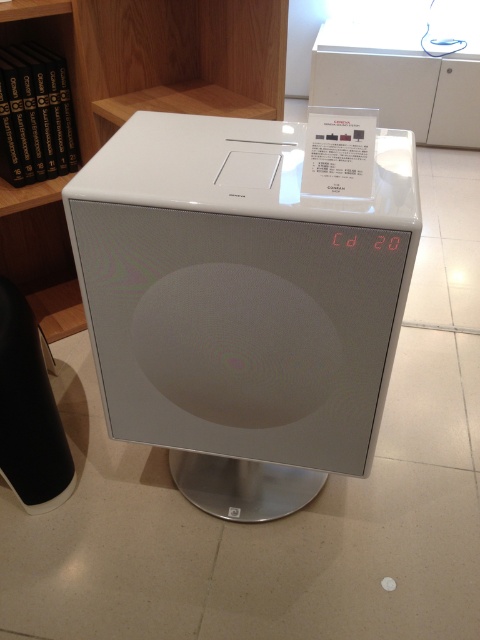
You are designing a display for an electronics store and need to place the white glossy air purifier at center and the white matte bookshelf at upper center. Based on their sizes, which object should be placed lower to ensure visual balance?

The white glossy air purifier at center is bigger than the white matte bookshelf at upper center, so to achieve visual balance, the larger air purifier should be placed lower while the smaller bookshelf is positioned higher.

You are standing in front of the audio device and want to locate two specific points marked on the image. The first point is at coordinate point(144, 376) and the second is at point(126, 22). Which point is closer to you?

Point(144, 376) is in front of point(126, 22), so the first point is closer to you.